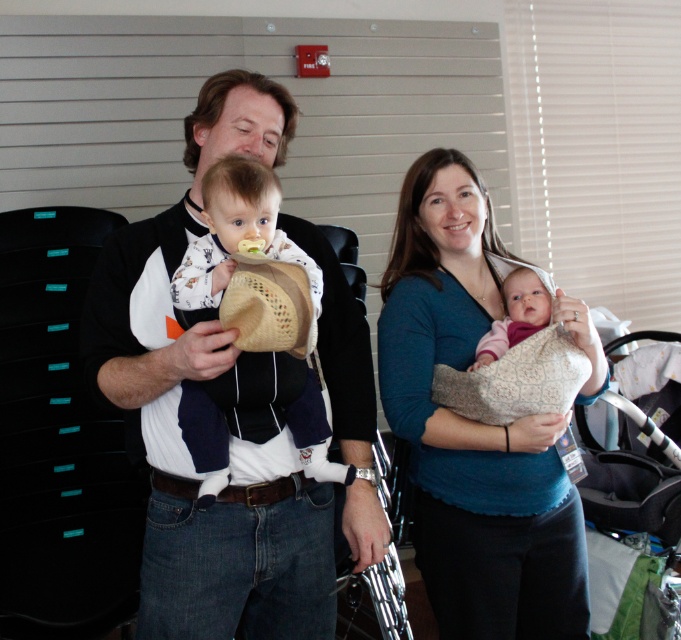
You are a photographer taking a picture of the blue soft fabric baby carrier at center and the white cotton baby at center. Which object is positioned higher in the image?

The white cotton baby at center is positioned higher than the blue soft fabric baby carrier at center.

You are a photographer taking a picture of two babies. You notice the white cotton baby at center and the pink soft fabric baby at center. Which baby is positioned closer to the camera?

The white cotton baby at center is closer to the camera than the pink soft fabric baby at center.

You are a photographer trying to frame a shot of the scene. The white cotton shirt at center and the white cotton baby at center are both in the frame. Which object should you adjust to ensure the baby is the focal point, considering their sizes?

The white cotton shirt at center is wider than the white cotton baby at center, so adjusting the focus to the smaller object, the white cotton baby at center, would make it the focal point.